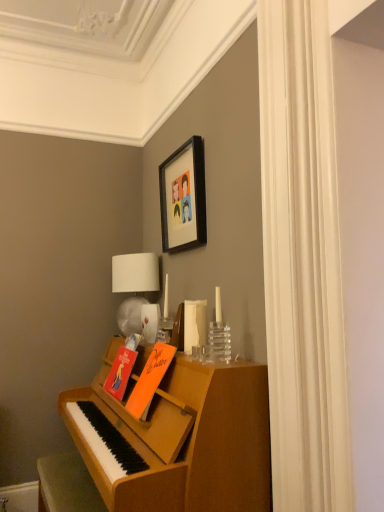
From the picture: Measure the distance between white fabric lampshade at upper center and camera.

white fabric lampshade at upper center and camera are 7.42 feet apart from each other.

Describe the element at coordinates (67, 485) in the screenshot. I see `wooden piano at lower left` at that location.

Measure the distance between point (198, 238) and camera.

2.06 meters.

Locate an element on the screen. white fabric lampshade at upper center is located at coordinates (134, 287).

From the image's perspective, which one is positioned higher, orange matte book at center, which is counted as the 1th book, starting from the front, or orange matte book at center, which appears as the 2th book when viewed from the front?

orange matte book at center, which is counted as the 1th book, starting from the front, is shown above in the image.

Considering the relative sizes of orange matte book at center, the second book positioned from the back, and orange matte book at center, which appears as the 2th book when viewed from the front, in the image provided, is orange matte book at center, the second book positioned from the back, smaller than orange matte book at center, which appears as the 2th book when viewed from the front,?

No.

Which is behind, orange matte book at center, the second book positioned from the back, or orange matte book at center, arranged as the first book when viewed from the back?

orange matte book at center, arranged as the first book when viewed from the back.

The height and width of the screenshot is (512, 384). Find the location of `picture frame above the orange matte book at center, which is counted as the 1th book, starting from the front (from the image's perspective)`. picture frame above the orange matte book at center, which is counted as the 1th book, starting from the front (from the image's perspective) is located at coordinates (183, 197).

Are orange matte book at center, the second book positioned from the back, and black matte picture frame at upper center making contact?

There is a gap between orange matte book at center, the second book positioned from the back, and black matte picture frame at upper center.

Considering the relative sizes of orange matte book at center, the second book positioned from the back, and black matte picture frame at upper center in the image provided, is orange matte book at center, the second book positioned from the back, thinner than black matte picture frame at upper center?

No.

Is black matte picture frame at upper center a part of orange matte book at center, which is counted as the 1th book, starting from the front?

Actually, black matte picture frame at upper center is outside orange matte book at center, which is counted as the 1th book, starting from the front.

How many degrees apart are the facing directions of white fabric lampshade at upper center and black matte picture frame at upper center?

37.6 degrees separate the facing orientations of white fabric lampshade at upper center and black matte picture frame at upper center.

Can you confirm if white fabric lampshade at upper center is bigger than black matte picture frame at upper center?

Yes.

Identify the location of picture frame located above the white fabric lampshade at upper center (from a real-world perspective). This screenshot has width=384, height=512. (183, 197).

Is the depth of wooden piano at lower left less than that of orange matte book at center, which is counted as the 1th book, starting from the front?

Yes, wooden piano at lower left is in front of orange matte book at center, which is counted as the 1th book, starting from the front.

Considering the sizes of objects wooden piano at lower left and orange matte book at center, which is counted as the 1th book, starting from the front, in the image provided, who is thinner, wooden piano at lower left or orange matte book at center, which is counted as the 1th book, starting from the front,?

orange matte book at center, which is counted as the 1th book, starting from the front.

Could you tell me if wooden piano at lower left is facing orange matte book at center, which is counted as the 1th book, starting from the front?

No, wooden piano at lower left is not facing towards orange matte book at center, which is counted as the 1th book, starting from the front.

From the image's perspective, who appears lower, wooden piano at lower left or orange matte book at center, the second book positioned from the back?

wooden piano at lower left, from the image's perspective.

Based on their positions, is orange matte book at center, arranged as the first book when viewed from the back, located to the left or right of wooden piano at lower left?

orange matte book at center, arranged as the first book when viewed from the back, is to the right of wooden piano at lower left.

Can you confirm if orange matte book at center, arranged as the first book when viewed from the back, is shorter than wooden piano at lower left?

Correct, orange matte book at center, arranged as the first book when viewed from the back, is not as tall as wooden piano at lower left.

Consider the image. Which object is wider, orange matte book at center, which appears as the 2th book when viewed from the front, or wooden piano at lower left?

wooden piano at lower left.

In the scene shown: Is black matte picture frame at upper center positioned far away from white fabric lampshade at upper center?

black matte picture frame at upper center is near white fabric lampshade at upper center, not far away.

Can white fabric lampshade at upper center be found inside black matte picture frame at upper center?

No, black matte picture frame at upper center does not contain white fabric lampshade at upper center.

Considering the positions of points (170, 234) and (128, 273), is point (170, 234) closer to camera compared to point (128, 273)?

That is True.

Which of these two, black matte picture frame at upper center or white fabric lampshade at upper center, is smaller?

With smaller size is black matte picture frame at upper center.

From a real-world perspective, is white fabric lampshade at upper center above or below orange matte book at center, the second book positioned from the back?

white fabric lampshade at upper center is situated higher than orange matte book at center, the second book positioned from the back, in the real world.

Is white fabric lampshade at upper center to the left or to the right of orange matte book at center, the second book positioned from the back, in the image?

Clearly, white fabric lampshade at upper center is on the left of orange matte book at center, the second book positioned from the back, in the image.

Considering the points (136, 275) and (162, 358), which point is in front, point (136, 275) or point (162, 358)?

The point (162, 358) is closer to the camera.

The width and height of the screenshot is (384, 512). In order to click on book directly beneath the orange matte book at center, the second book positioned from the back (from a real-world perspective) in this screenshot , I will do `click(120, 372)`.

Find the location of a particular element. book that is the 1st one when counting leftward from the black matte picture frame at upper center is located at coordinates point(150,380).

Based on their spatial positions, is wooden piano at lower left or orange matte book at center, the second book positioned from the back, closer to black matte picture frame at upper center?

Based on the image, orange matte book at center, the second book positioned from the back, appears to be nearer to black matte picture frame at upper center.

When comparing their distances from wooden piano at lower left, does orange matte book at center, arranged as the first book when viewed from the back, or black matte picture frame at upper center seem closer?

orange matte book at center, arranged as the first book when viewed from the back, is closer to wooden piano at lower left.

Which object lies nearer to the anchor point orange matte book at center, which appears as the 2th book when viewed from the front, black matte picture frame at upper center or orange matte book at center, the second book positioned from the back?

orange matte book at center, the second book positioned from the back, lies closer to orange matte book at center, which appears as the 2th book when viewed from the front, than the other object.

Considering their positions, is white fabric lampshade at upper center positioned further to orange matte book at center, which appears as the 2th book when viewed from the front, than black matte picture frame at upper center?

black matte picture frame at upper center.

From the image, which object appears to be nearer to black matte picture frame at upper center, white fabric lampshade at upper center or orange matte book at center, which is counted as the 1th book, starting from the front?

white fabric lampshade at upper center is closer to black matte picture frame at upper center.

From the image, which object appears to be farther from orange matte book at center, the second book positioned from the back, orange matte book at center, which appears as the 2th book when viewed from the front, or wooden piano at lower left?

wooden piano at lower left.

When comparing their distances from orange matte book at center, the second book positioned from the back, does white fabric lampshade at upper center or orange matte book at center, arranged as the first book when viewed from the back, seem further?

Based on the image, white fabric lampshade at upper center appears to be further to orange matte book at center, the second book positioned from the back.

Which object lies nearer to the anchor point wooden piano at lower left, black matte picture frame at upper center or white fabric lampshade at upper center?

white fabric lampshade at upper center lies closer to wooden piano at lower left than the other object.

Where is `book between black matte picture frame at upper center and orange matte book at center, arranged as the first book when viewed from the back, in the vertical direction`? The width and height of the screenshot is (384, 512). book between black matte picture frame at upper center and orange matte book at center, arranged as the first book when viewed from the back, in the vertical direction is located at coordinates (150, 380).

Where is `book positioned between orange matte book at center, the second book positioned from the back, and white fabric lampshade at upper center from near to far`? book positioned between orange matte book at center, the second book positioned from the back, and white fabric lampshade at upper center from near to far is located at coordinates (120, 372).

The width and height of the screenshot is (384, 512). What are the coordinates of `book between orange matte book at center, the second book positioned from the back, and wooden piano at lower left in the up-down direction` in the screenshot? It's located at (120, 372).

Identify the location of table lamp that lies between black matte picture frame at upper center and wooden piano at lower left from top to bottom. The height and width of the screenshot is (512, 384). (134, 287).